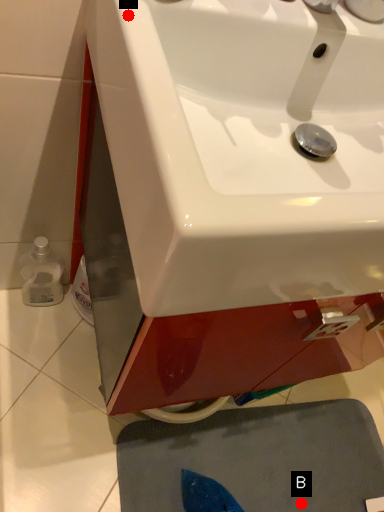
Question: Two points are circled on the image, labeled by A and B beside each circle. Which point is farther from the camera taking this photo?

Choices:
 (A) A is further
 (B) B is further

Answer: (B)